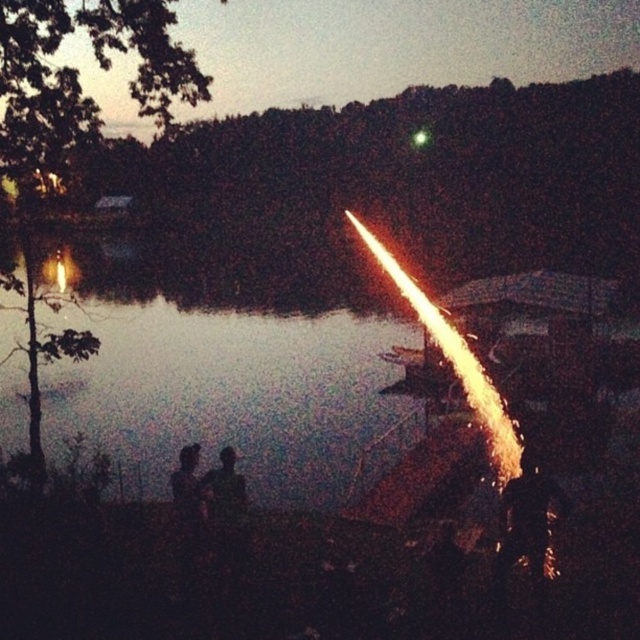
Question: Is bright orange flame at center above black matte person at lower center?

Choices:
 (A) yes
 (B) no

Answer: (A)

Question: Does dark fabric figure at center appear on the right side of black matte person at lower center?

Choices:
 (A) no
 (B) yes

Answer: (B)

Question: Which of these objects is positioned farthest from the dark hair human at center?

Choices:
 (A) dark fabric figure at center
 (B) bright orange flame at center

Answer: (B)

Question: Can you confirm if bright orange flame at center is positioned below black matte person at lower center?

Choices:
 (A) no
 (B) yes

Answer: (A)

Question: Which point is closer to the camera?

Choices:
 (A) (220, 516)
 (B) (504, 420)
 (C) (296, 433)

Answer: (A)

Question: Which point appears closest to the camera in this image?

Choices:
 (A) (186, 513)
 (B) (216, 508)
 (C) (513, 557)
 (D) (515, 468)

Answer: (C)